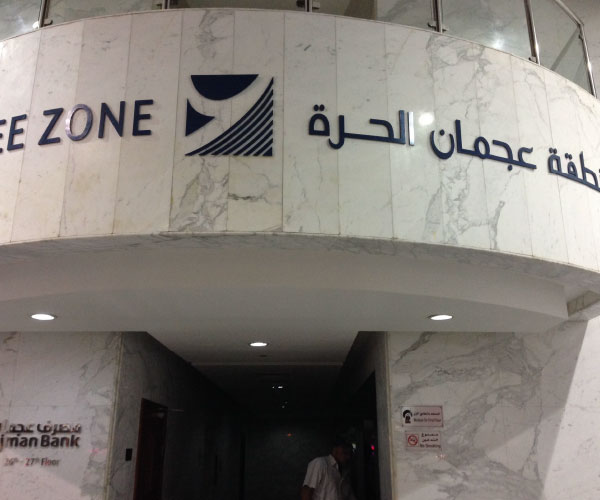
You are a GUI agent. You are given a task and a screenshot of the screen. Output one action in this format:
    pyautogui.click(x=<x>, y=<y>)
    Task: Click on the marble walls
    Image resolution: width=600 pixels, height=500 pixels.
    Given the screenshot: What is the action you would take?
    pyautogui.click(x=498, y=403), pyautogui.click(x=113, y=406), pyautogui.click(x=455, y=210), pyautogui.click(x=211, y=203)